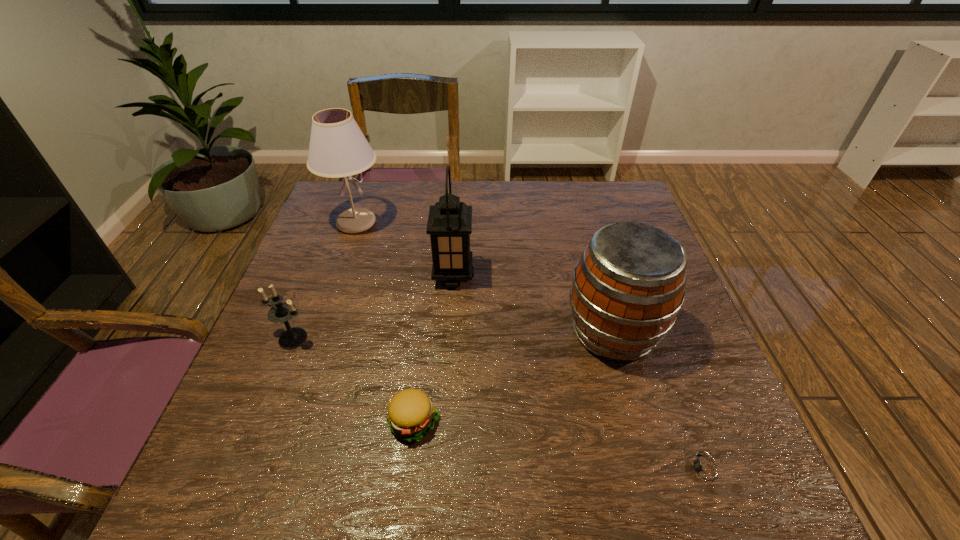
The height and width of the screenshot is (540, 960). Identify the location of free space that satisfies the following two spatial constraints: 1. on the front side of the farthest object; 2. on the left side of the cider. (319, 332).

Where is `vacant area that satisfies the following two spatial constraints: 1. on the front side of the lantern; 2. on the right side of the cider`? The height and width of the screenshot is (540, 960). vacant area that satisfies the following two spatial constraints: 1. on the front side of the lantern; 2. on the right side of the cider is located at coordinates (449, 332).